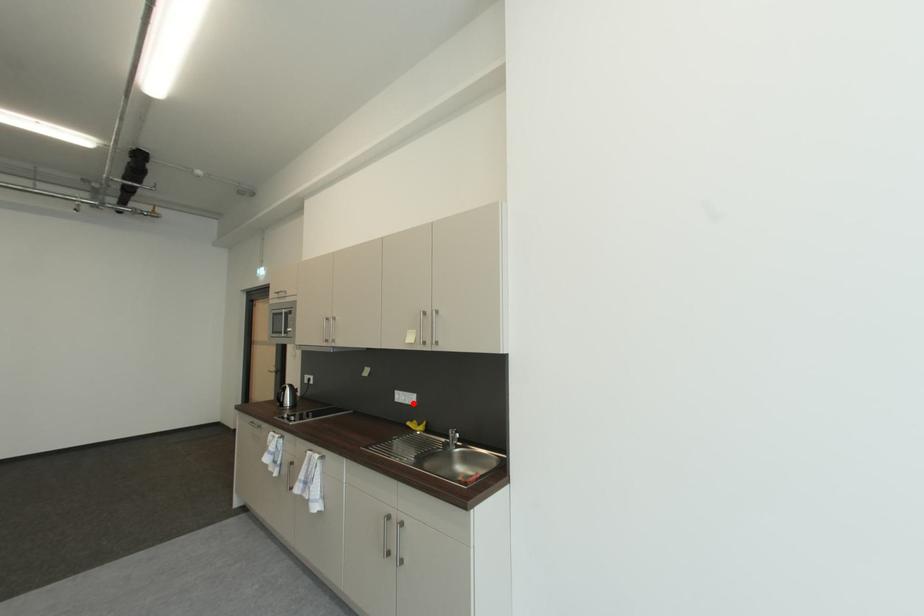
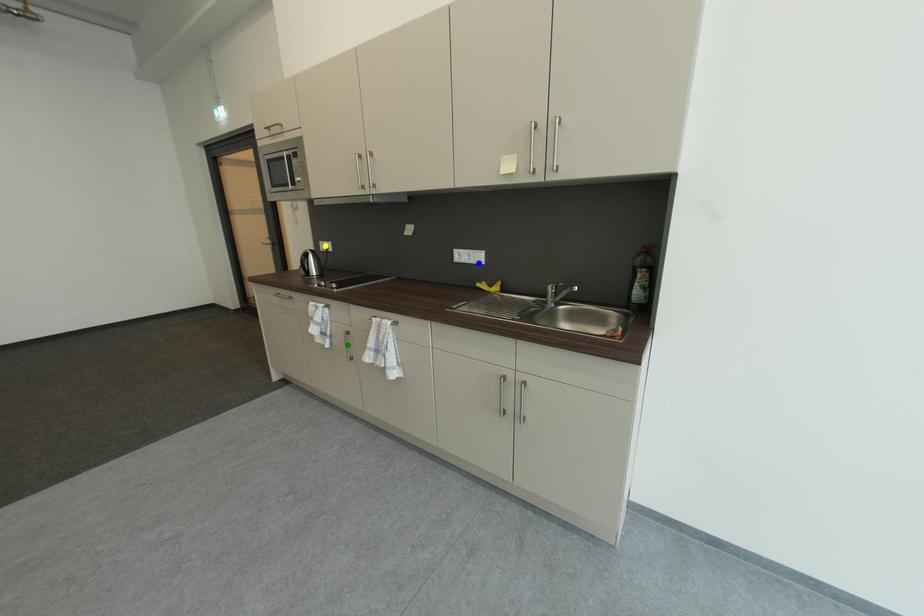
Question: I am providing you with two images of the same scene from different viewpoints. A red point is marked on the first image. You are given multiple points on the second image. Can you choose the point in image 2 that corresponds to the point in image 1?

Choices:
 (A) yellow point
 (B) blue point
 (C) green point

Answer: (B)